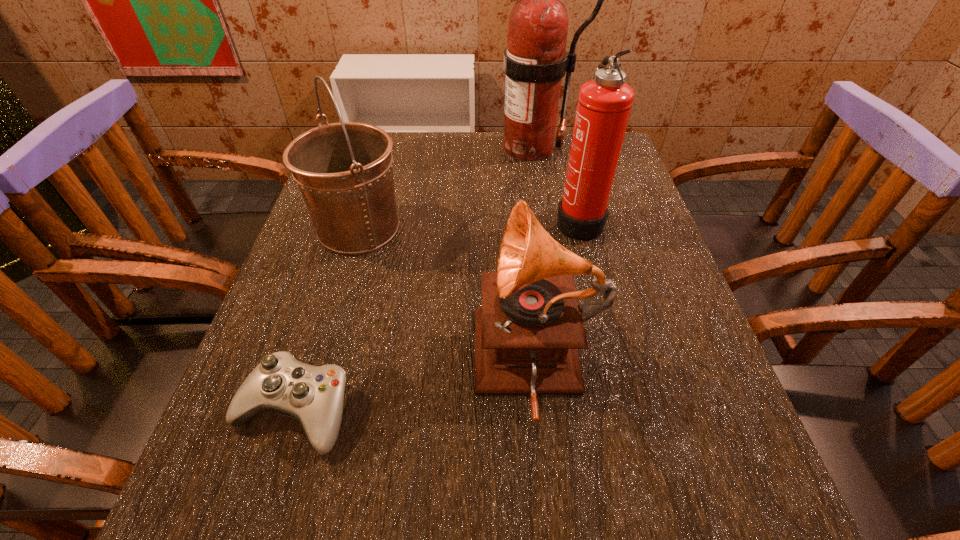
Locate an element on the screen. This screenshot has width=960, height=540. free space located on the front-facing side of the nearer fire extinguisher is located at coordinates (403, 220).

What are the coordinates of `vacant region located 0.140m on the front-facing side of the nearer fire extinguisher` in the screenshot? It's located at (495, 220).

Find the location of `vacant space located on the front-facing side of the nearer fire extinguisher`. vacant space located on the front-facing side of the nearer fire extinguisher is located at coordinates (458, 220).

In order to click on free space located 0.190m on the back of the bucket in this screenshot , I will do `click(379, 160)`.

This screenshot has width=960, height=540. Find the location of `free space located 0.100m on the horn of the phonograph record`. free space located 0.100m on the horn of the phonograph record is located at coordinates click(418, 366).

Where is `free location located on the horn of the phonograph record`? The width and height of the screenshot is (960, 540). free location located on the horn of the phonograph record is located at coordinates (423, 366).

This screenshot has height=540, width=960. Find the location of `free spot located 0.290m on the horn of the phonograph record`. free spot located 0.290m on the horn of the phonograph record is located at coordinates (308, 366).

Image resolution: width=960 pixels, height=540 pixels. In order to click on free space located on the right of the control in this screenshot , I will do `click(542, 410)`.

Find the location of a particular element. Image resolution: width=960 pixels, height=540 pixels. object that is positioned at the far edge is located at coordinates (535, 61).

Where is `bucket positioned at the left edge`? This screenshot has width=960, height=540. bucket positioned at the left edge is located at coordinates (344, 171).